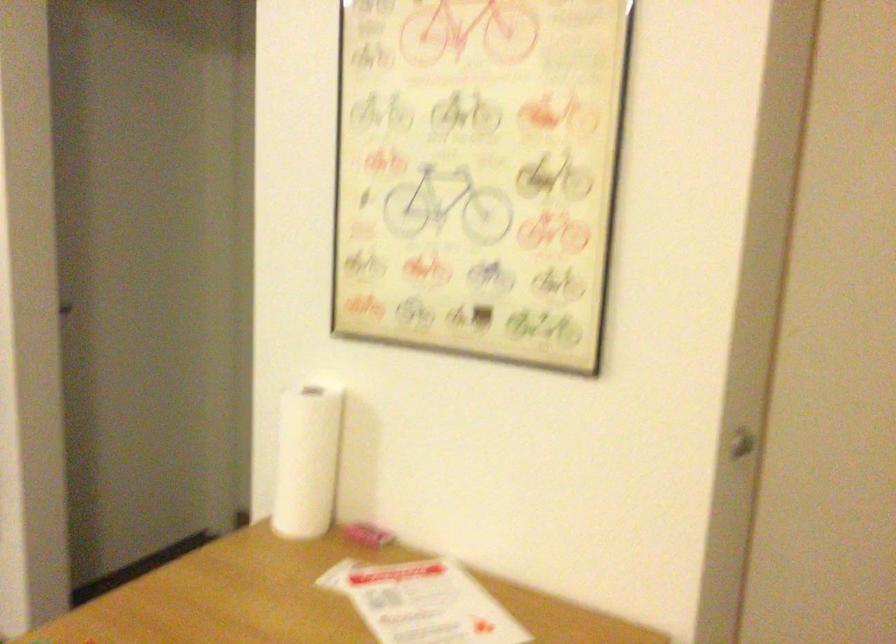
Question: The camera is either moving clockwise (left) or counter-clockwise (right) around the object. The first image is from the beginning of the video and the second image is from the end. Is the camera moving left or right when shooting the video?

Choices:
 (A) Left
 (B) Right

Answer: (B)